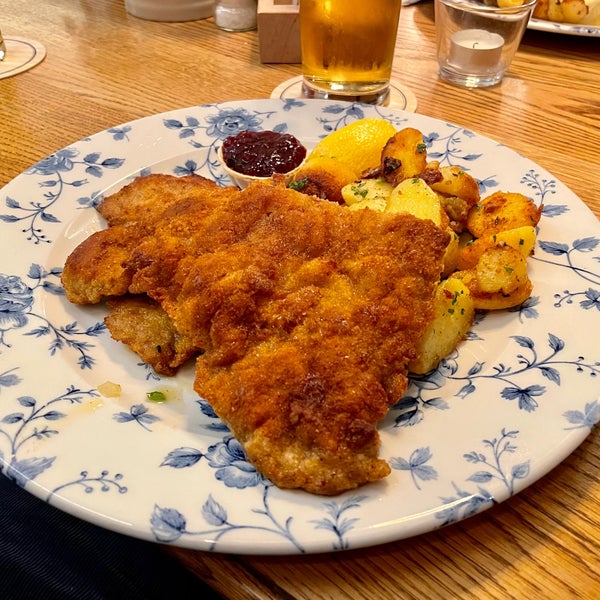
You are a GUI agent. You are given a task and a screenshot of the screen. Output one action in this format:
    pyautogui.click(x=<x>, y=<y>)
    Task: Click on the small glass cup
    
    Given the screenshot: What is the action you would take?
    pyautogui.click(x=514, y=14)